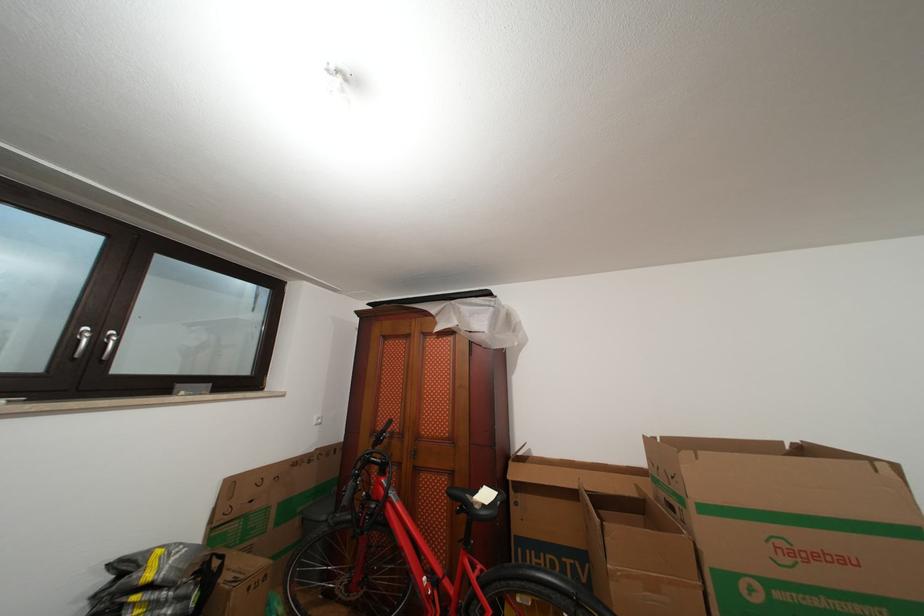
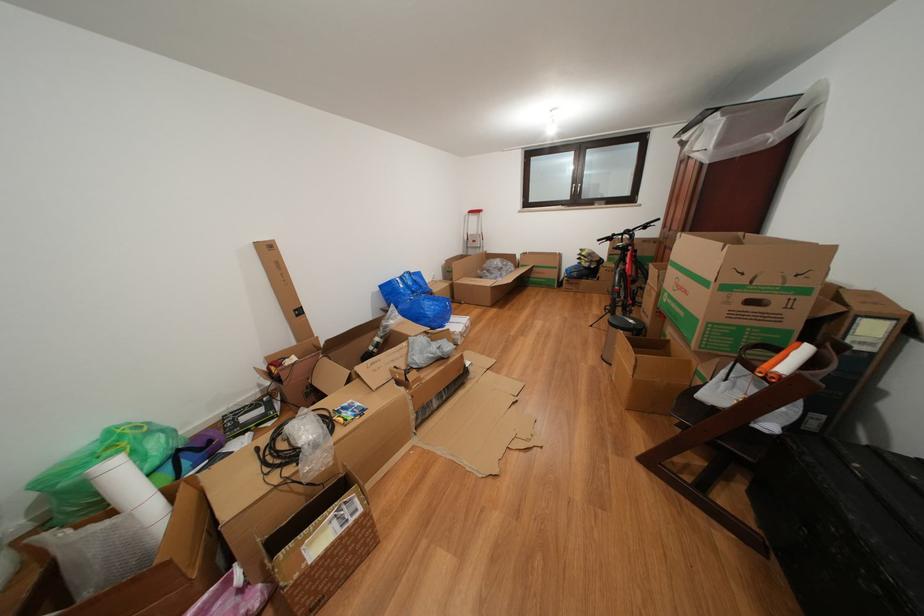
The point at (853, 565) is marked in the first image. Where is the corresponding point in the second image?

(694, 297)